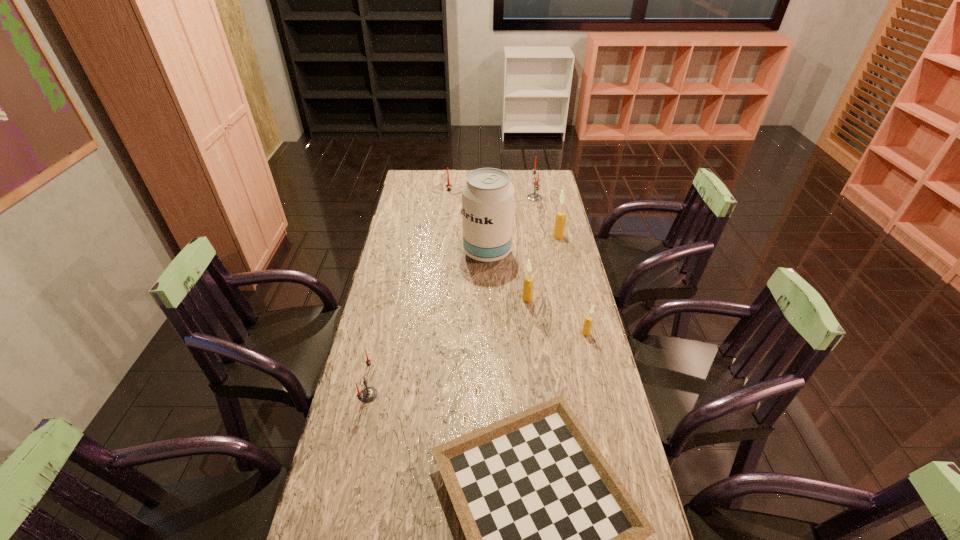
This screenshot has height=540, width=960. I want to click on the sixth farthest object, so click(588, 321).

I want to click on the leftmost red candle, so click(368, 394).

You are a GUI agent. You are given a task and a screenshot of the screen. Output one action in this format:
    pyautogui.click(x=<x>, y=<y>)
    Task: Click on the smallest red candle
    This screenshot has height=540, width=960.
    Given the screenshot: What is the action you would take?
    pyautogui.click(x=368, y=394)

Where is `free location located 0.250m on the front of the alcohol`? The image size is (960, 540). free location located 0.250m on the front of the alcohol is located at coordinates (489, 313).

Find the location of a particular element. vacant space located 0.120m on the front-facing side of the second candle from left to right is located at coordinates (470, 233).

This screenshot has height=540, width=960. Find the location of `free spot located on the left of the biggest cream candle`. free spot located on the left of the biggest cream candle is located at coordinates (462, 237).

At what (x,y) coordinates should I click in order to perform the action: click on free space located on the front-facing side of the rightmost red candle. Please return your answer as a coordinate pair (x, y). Looking at the image, I should click on (475, 198).

Where is `vacant space located on the front-facing side of the rightmost red candle`? The width and height of the screenshot is (960, 540). vacant space located on the front-facing side of the rightmost red candle is located at coordinates (493, 198).

The image size is (960, 540). I want to click on vacant space situated on the front-facing side of the rightmost red candle, so click(468, 198).

Find the location of a particular element. free spot located 0.140m on the right of the third nearest candle is located at coordinates (571, 299).